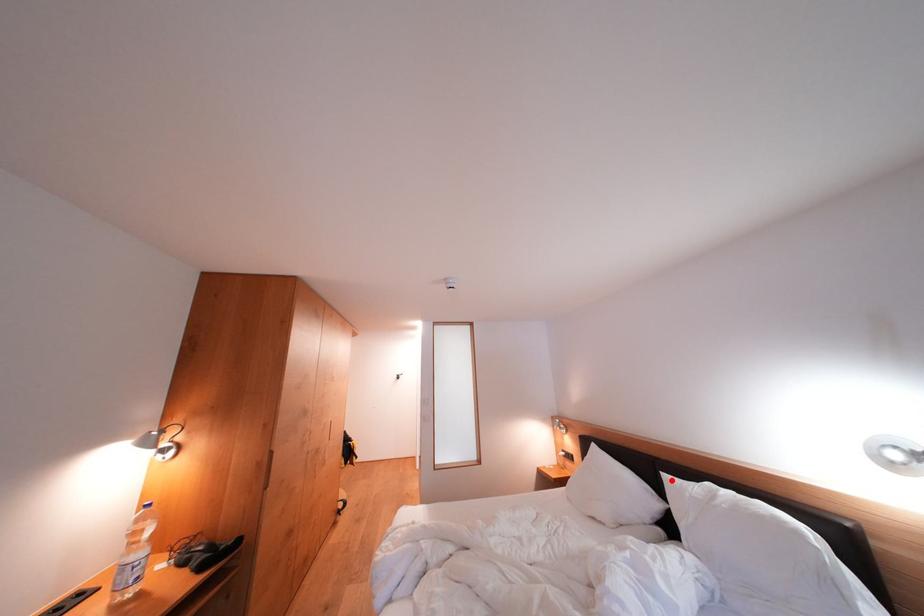
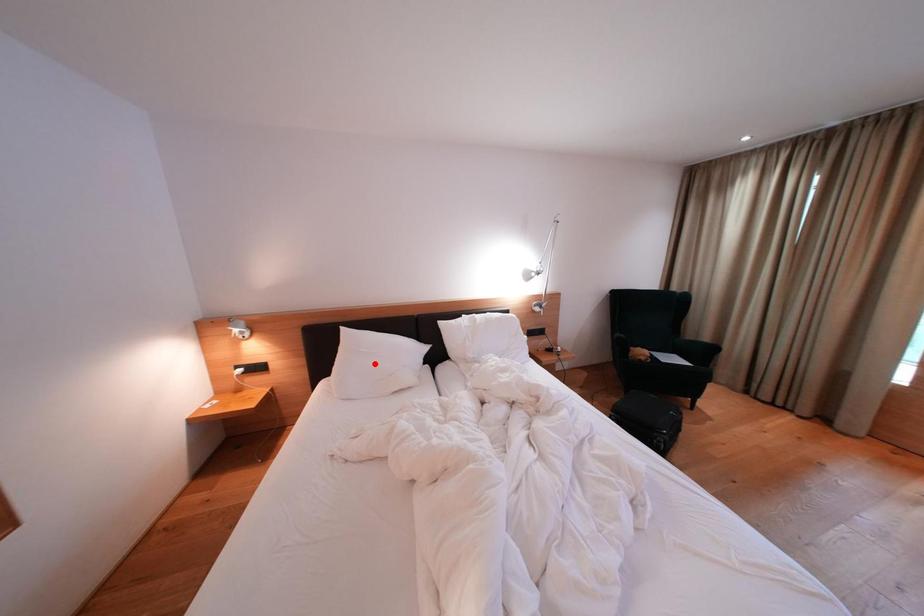
I am providing you with two images of the same scene from different viewpoints. A red point is marked on the first image and another point is marked on the second image. Does the point marked in image1 correspond to the same location as the one in image2?

No